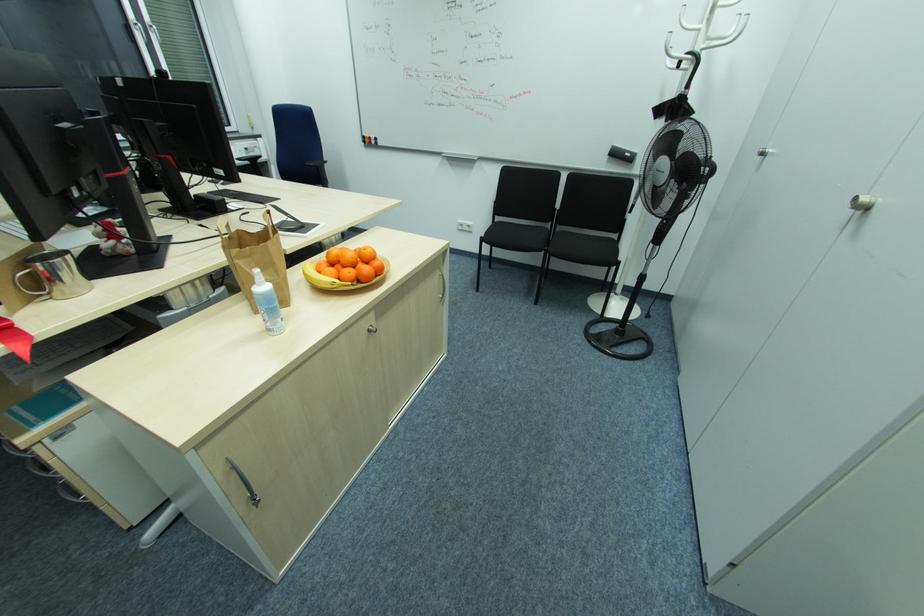
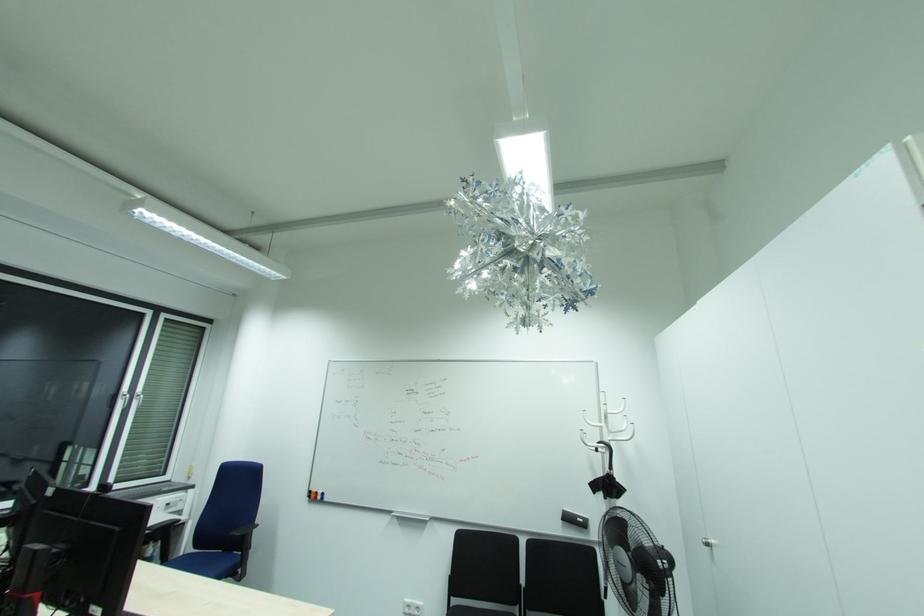
Question: How did the camera likely rotate?

Choices:
 (A) Left
 (B) Right
 (C) Up
 (D) Down

Answer: (C)